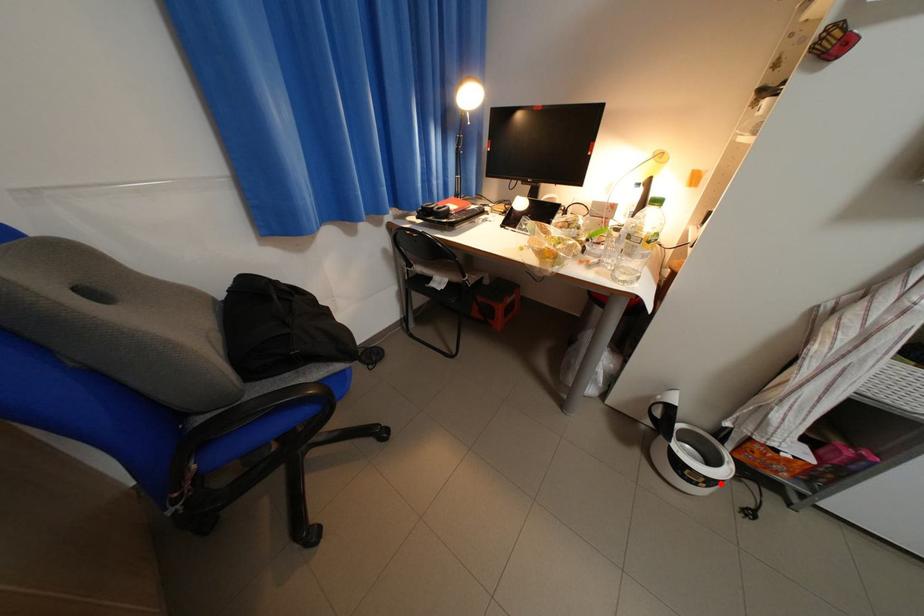
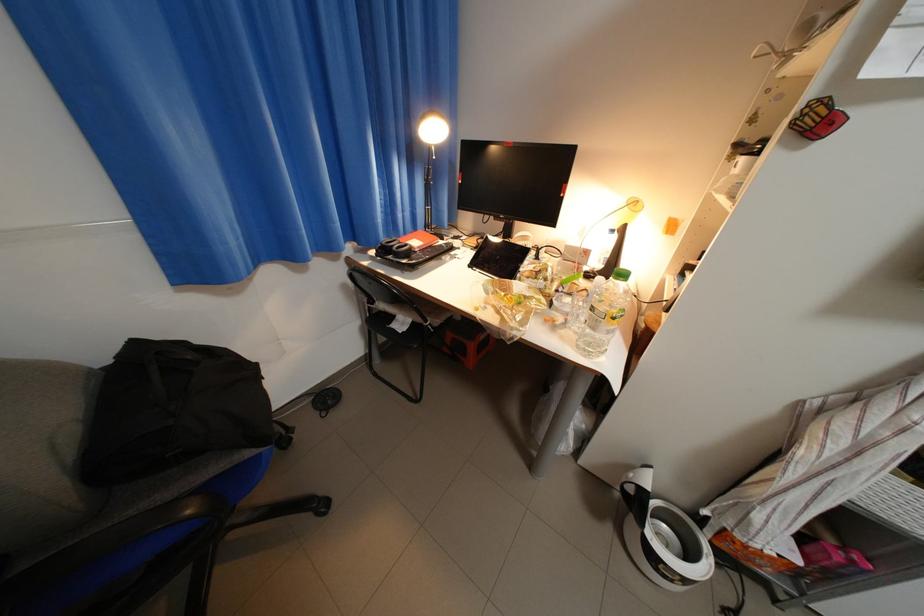
In the second image, find the point that corresponds to the highlighted location in the first image.

(698, 582)